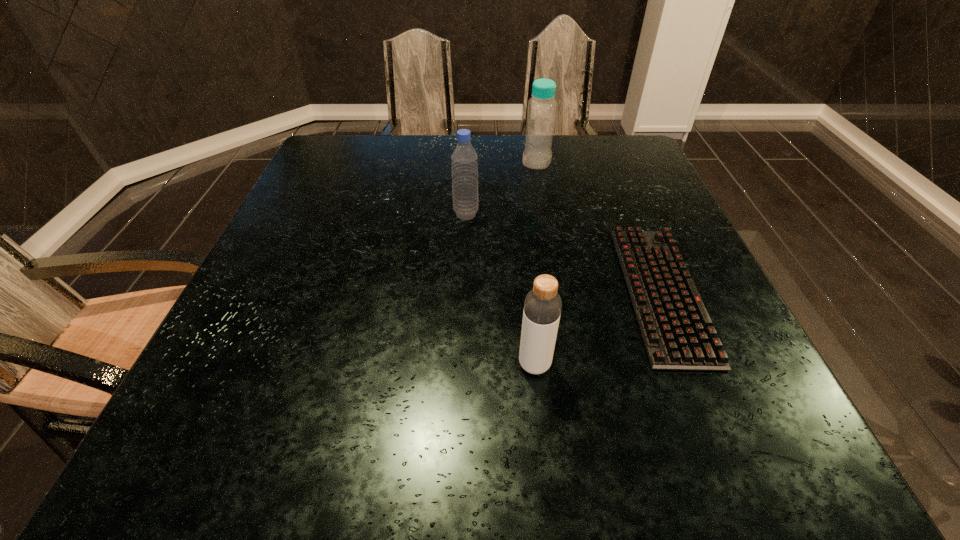
At what (x,y) coordinates should I click in order to perform the action: click on the farthest object. Please return your answer as a coordinate pair (x, y). Looking at the image, I should click on (541, 111).

In order to click on the leftmost object in this screenshot , I will do `click(464, 161)`.

Where is `the third nearest object`? The width and height of the screenshot is (960, 540). the third nearest object is located at coordinates (464, 161).

I want to click on the nearest bottle, so click(x=542, y=307).

Where is `the shortest object`? the shortest object is located at coordinates tap(677, 332).

Identify the location of the rightmost object. (677, 332).

Find the location of `vacant region located 0.300m on the left of the farthest object`. vacant region located 0.300m on the left of the farthest object is located at coordinates (415, 161).

The image size is (960, 540). In order to click on vacant space located 0.320m on the right of the second nearest bottle in this screenshot , I will do `click(612, 214)`.

Locate an element on the screen. This screenshot has height=540, width=960. vacant area situated on the back of the nearest bottle is located at coordinates (528, 305).

I want to click on free space located on the left of the shortest object, so click(x=585, y=292).